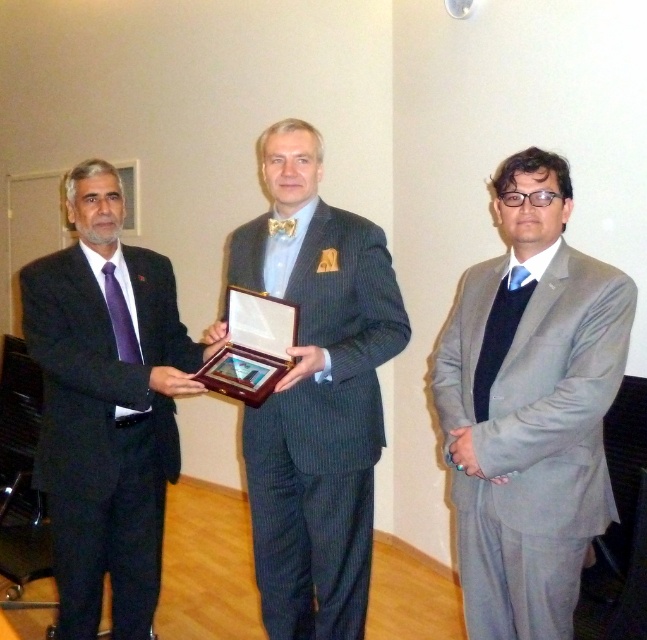
Question: Is gray suit at center smaller than matte black suit at left?

Choices:
 (A) yes
 (B) no

Answer: (A)

Question: Considering the real-world distances, which object is farthest from the matte black suit at left?

Choices:
 (A) pinstriped suit at center
 (B) gray suit at center

Answer: (B)

Question: Does gray suit at center have a lesser width compared to matte black suit at left?

Choices:
 (A) no
 (B) yes

Answer: (B)

Question: Does pinstriped suit at center have a greater width compared to matte black suit at left?

Choices:
 (A) no
 (B) yes

Answer: (B)

Question: Which object is farther from the camera taking this photo?

Choices:
 (A) pinstriped suit at center
 (B) matte black suit at left
 (C) gray suit at center

Answer: (B)

Question: Which point is farther to the camera?

Choices:
 (A) tap(105, 524)
 (B) tap(499, 230)

Answer: (B)